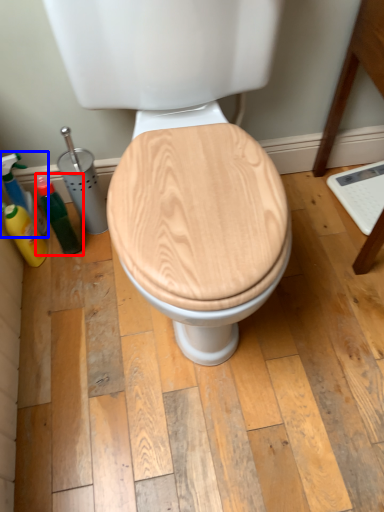
Question: Which object appears farthest to the camera in this image, bottle (highlighted by a red box) or cleaning product (highlighted by a blue box)?

Choices:
 (A) bottle
 (B) cleaning product

Answer: (B)